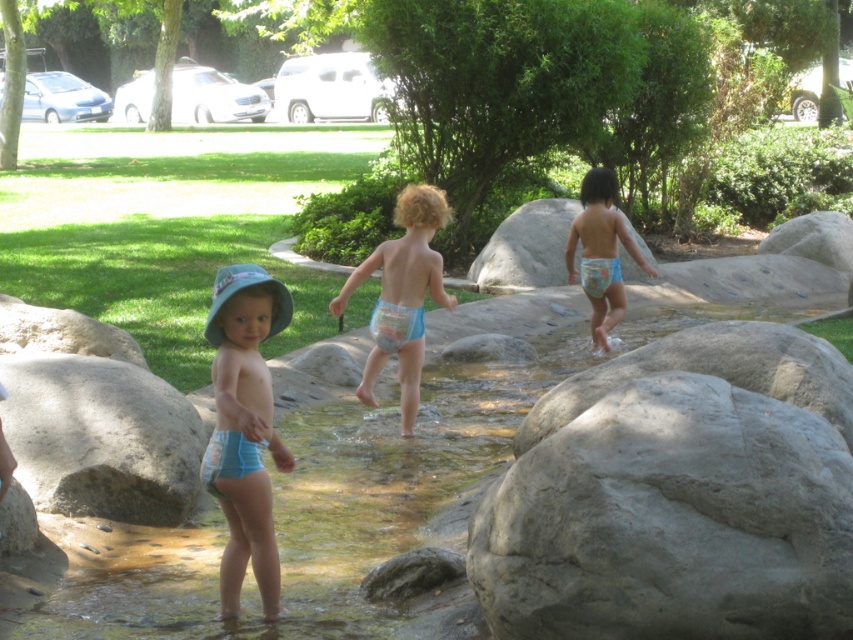
In the scene shown: You are a parent trying to locate your child who is playing in the stream. You see the gray rough rock at lower right and the blue cloth diaper at center. Which object is closer to the bottom of the image?

The gray rough rock at lower right is closer to the bottom of the image because it is positioned below the blue cloth diaper at center.